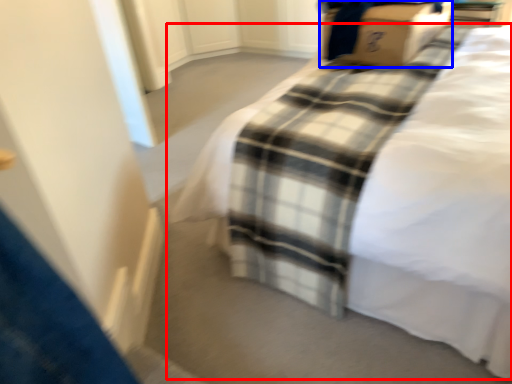
Question: Which object is further to the camera taking this photo, bed (highlighted by a red box) or cardboard box (highlighted by a blue box)?

Choices:
 (A) bed
 (B) cardboard box

Answer: (B)